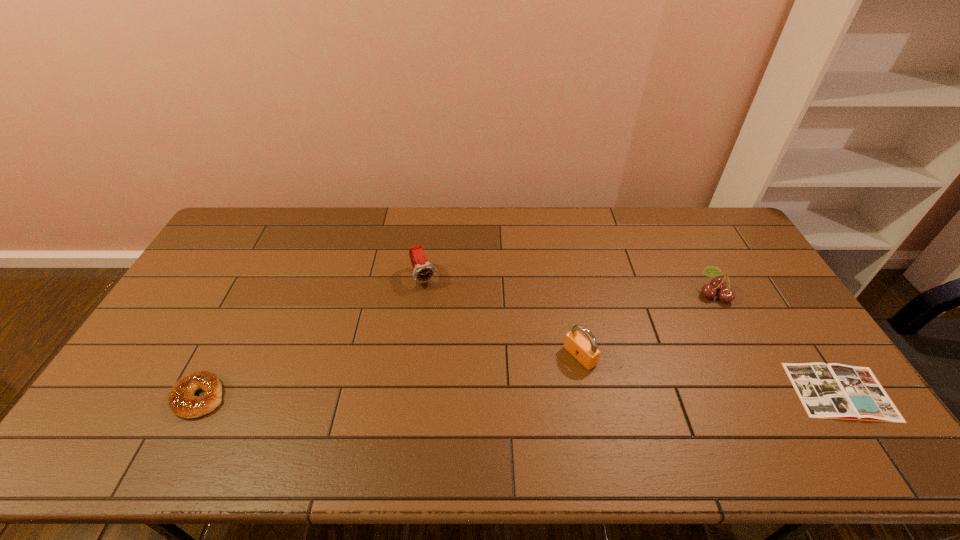
At what (x,y) coordinates should I click in order to perform the action: click on vacant space situated 0.110m to unlock the third object from left to right from the front. Please return your answer as a coordinate pair (x, y). This screenshot has height=540, width=960. Looking at the image, I should click on (539, 384).

Identify the location of free spot located 0.140m to unlock the third object from left to right from the front. This screenshot has height=540, width=960. (530, 390).

Find the location of a particular element. This screenshot has width=960, height=540. vacant space located 0.050m to unlock the third object from left to right from the front is located at coordinates tap(556, 374).

Where is `free spot located 0.360m on the face of the fourth object from right to left`? This screenshot has height=540, width=960. free spot located 0.360m on the face of the fourth object from right to left is located at coordinates (471, 377).

Locate an element on the screen. Image resolution: width=960 pixels, height=540 pixels. vacant space located 0.050m on the face of the fourth object from right to left is located at coordinates (433, 300).

At what (x,y) coordinates should I click in order to perform the action: click on vacant area located 0.330m on the face of the fourth object from right to left. Please return your answer as a coordinate pair (x, y). Looking at the image, I should click on (468, 368).

Identify the location of vacant space situated 0.140m on the leaves of the cherry. This screenshot has height=540, width=960. click(x=680, y=323).

Where is `free region located 0.320m on the leaves of the cherry`? The width and height of the screenshot is (960, 540). free region located 0.320m on the leaves of the cherry is located at coordinates (643, 354).

What are the coordinates of `vacant space located on the leaves of the cherry` in the screenshot? It's located at (684, 320).

Image resolution: width=960 pixels, height=540 pixels. I want to click on bagel present at the near edge, so click(182, 401).